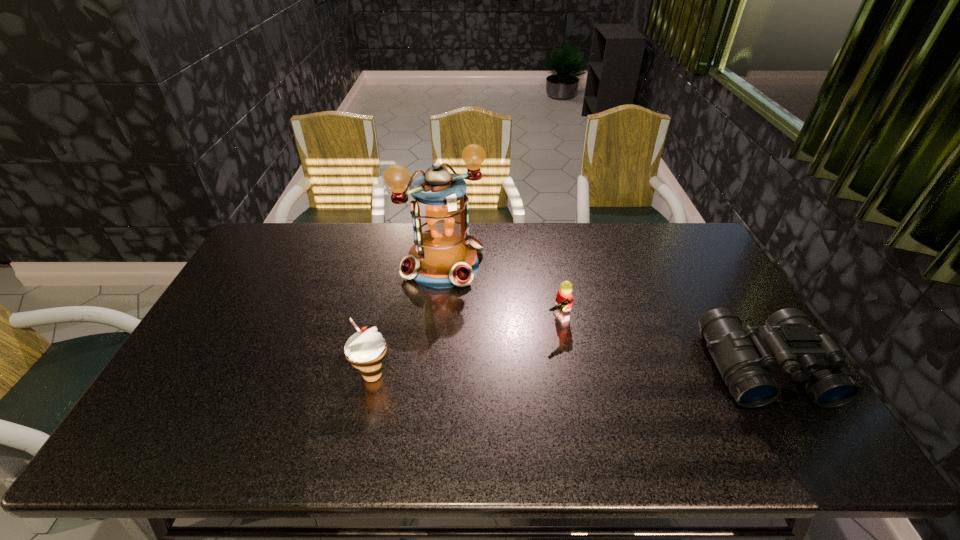
Image resolution: width=960 pixels, height=540 pixels. In order to click on free spot on the desktop that is between the icecream and the rightmost object and is positioned on the front-facing side of the tallest object in this screenshot , I will do `click(540, 372)`.

Locate an element on the screen. Image resolution: width=960 pixels, height=540 pixels. free spot on the desktop that is between the icecream and the rightmost object and is positioned in front of the Lego with the accessory visible is located at coordinates (599, 371).